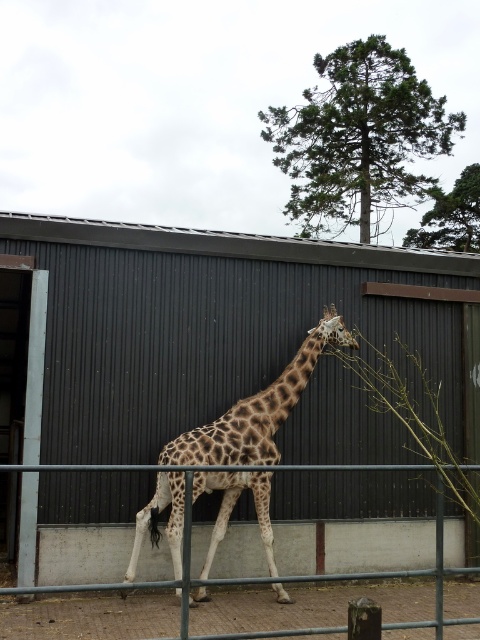
Is spotted fur giraffe at center thinner than metal/grey fence at lower center?

Yes, spotted fur giraffe at center is thinner than metal/grey fence at lower center.

Is spotted fur giraffe at center smaller than metal/grey fence at lower center?

Correct, spotted fur giraffe at center occupies less space than metal/grey fence at lower center.

What are the coordinates of `spotted fur giraffe at center` in the screenshot? It's located at (x=257, y=410).

At what (x,y) coordinates should I click in order to perform the action: click on spotted fur giraffe at center. Please return your answer as a coordinate pair (x, y). Image resolution: width=480 pixels, height=640 pixels. Looking at the image, I should click on (257, 410).